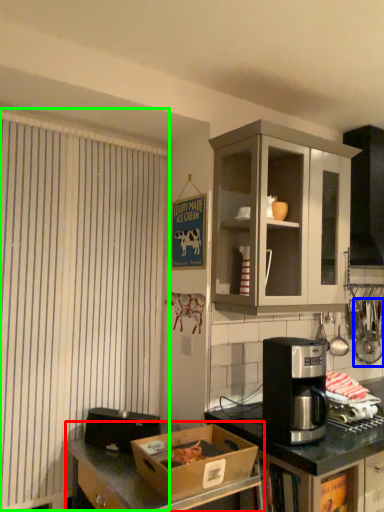
Question: Which object is the closest to the desk (highlighted by a red box)? Choose among these: appliance (highlighted by a blue box) or curtain (highlighted by a green box).

Choices:
 (A) appliance
 (B) curtain

Answer: (B)